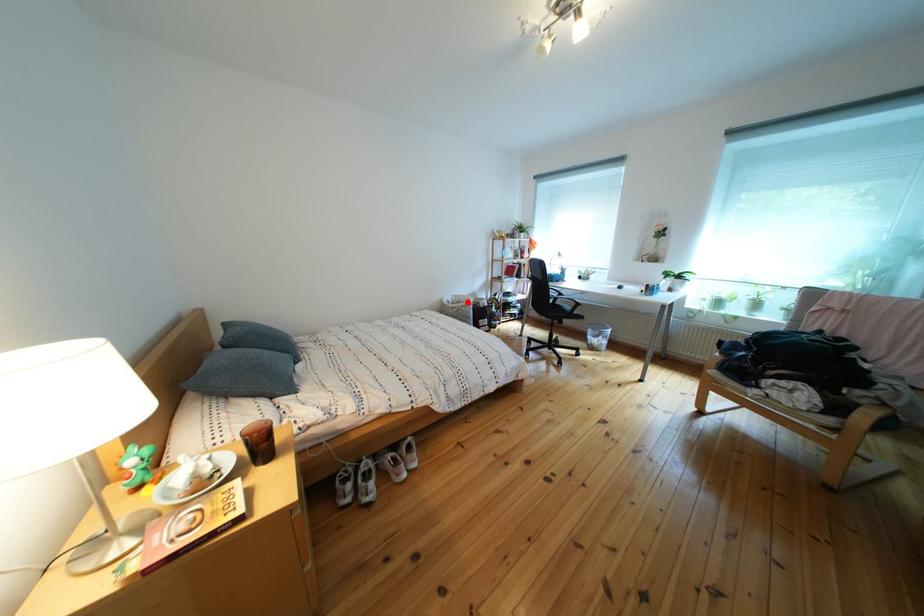
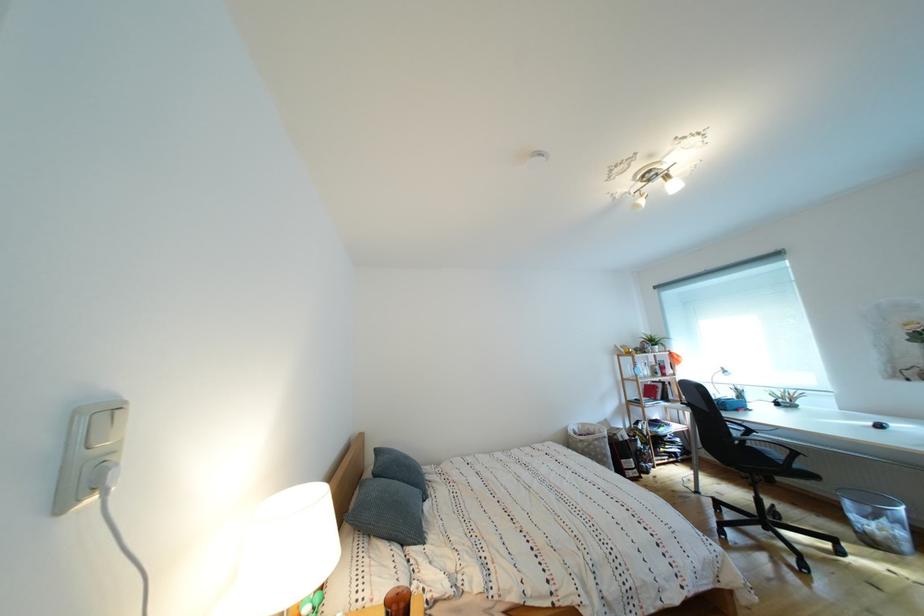
Question: I am providing you with two images of the same scene from different viewpoints. A red point is marked on the first image. Is the red point's position out of view in image 2?

Choices:
 (A) Yes
 (B) No

Answer: (B)